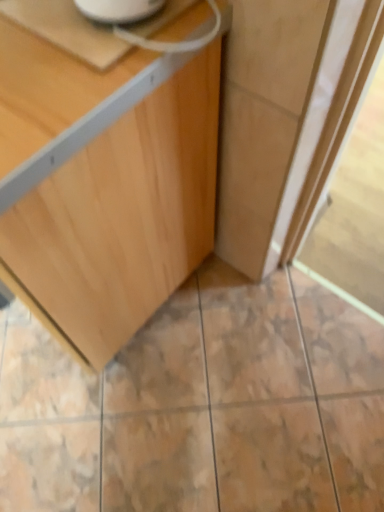
Locate an element on the screen. This screenshot has width=384, height=512. light wood cabinet at center is located at coordinates (108, 187).

The width and height of the screenshot is (384, 512). What do you see at coordinates (108, 187) in the screenshot? I see `light wood cabinet at center` at bounding box center [108, 187].

What is the approximate width of light wood cabinet at center?

light wood cabinet at center is 23.67 inches in width.

Where is `light wood cabinet at center`? This screenshot has height=512, width=384. light wood cabinet at center is located at coordinates (108, 187).